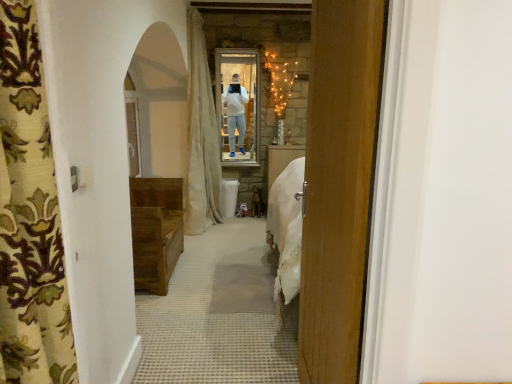
Question: Does patterned fabric curtain at left, acting as the 2th curtain starting from the back, have a smaller size compared to wooden door at center?

Choices:
 (A) no
 (B) yes

Answer: (B)

Question: Could you tell me if patterned fabric curtain at left, acting as the 2th curtain starting from the back, is turned towards wooden door at center?

Choices:
 (A) yes
 (B) no

Answer: (B)

Question: Does patterned fabric curtain at left, acting as the 2th curtain starting from the back, have a lesser height compared to wooden door at center?

Choices:
 (A) no
 (B) yes

Answer: (B)

Question: Is patterned fabric curtain at left, the first curtain viewed from the front, surrounding wooden door at center?

Choices:
 (A) yes
 (B) no

Answer: (B)

Question: Does patterned fabric curtain at left, acting as the 2th curtain starting from the back, have a larger size compared to wooden door at center?

Choices:
 (A) yes
 (B) no

Answer: (B)

Question: From a real-world perspective, relative to white fabric curtain at center, the 2th curtain viewed from the front, is patterned fabric curtain at left, the first curtain viewed from the front, vertically above or below?

Choices:
 (A) above
 (B) below

Answer: (A)

Question: Is patterned fabric curtain at left, acting as the 2th curtain starting from the back, wider or thinner than white fabric curtain at center, the 2th curtain viewed from the front?

Choices:
 (A) wide
 (B) thin

Answer: (B)

Question: Is patterned fabric curtain at left, the first curtain viewed from the front, situated inside white fabric curtain at center, the 2th curtain viewed from the front, or outside?

Choices:
 (A) inside
 (B) outside

Answer: (B)

Question: From the image's perspective, is patterned fabric curtain at left, acting as the 2th curtain starting from the back, above or below white fabric curtain at center, the 2th curtain viewed from the front?

Choices:
 (A) above
 (B) below

Answer: (B)

Question: Looking at the image, does wooden door at center seem bigger or smaller compared to wooden chest at left?

Choices:
 (A) small
 (B) big

Answer: (A)

Question: Considering the positions of point (321, 263) and point (158, 246), is point (321, 263) closer or farther from the camera than point (158, 246)?

Choices:
 (A) farther
 (B) closer

Answer: (B)

Question: Choose the correct answer: Is wooden door at center inside wooden chest at left or outside it?

Choices:
 (A) inside
 (B) outside

Answer: (B)

Question: From a real-world perspective, relative to wooden chest at left, is wooden door at center vertically above or below?

Choices:
 (A) above
 (B) below

Answer: (A)

Question: Would you say matte glass mirror at center is to the left or to the right of wooden chest at left in the picture?

Choices:
 (A) left
 (B) right

Answer: (B)

Question: From the image's perspective, is matte glass mirror at center positioned above or below wooden chest at left?

Choices:
 (A) above
 (B) below

Answer: (A)